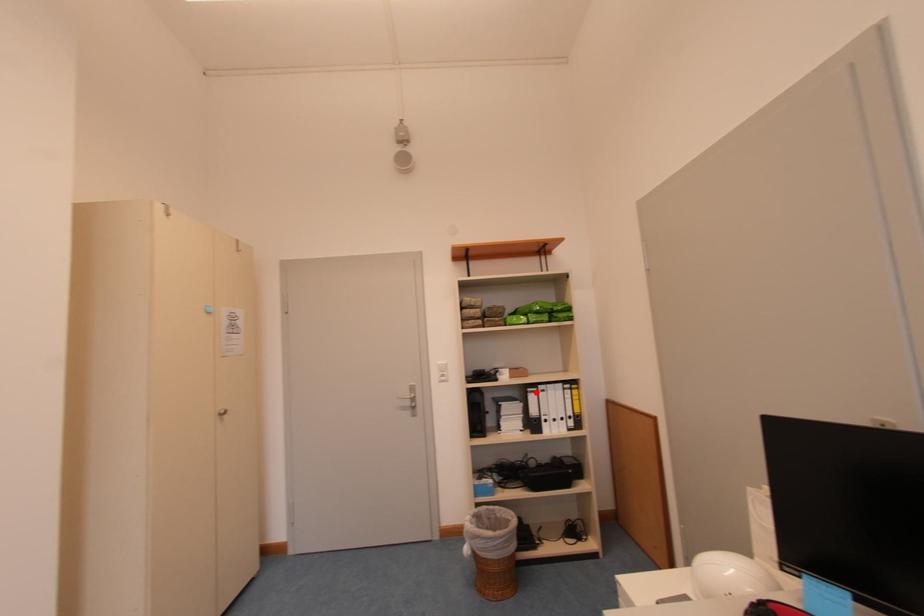
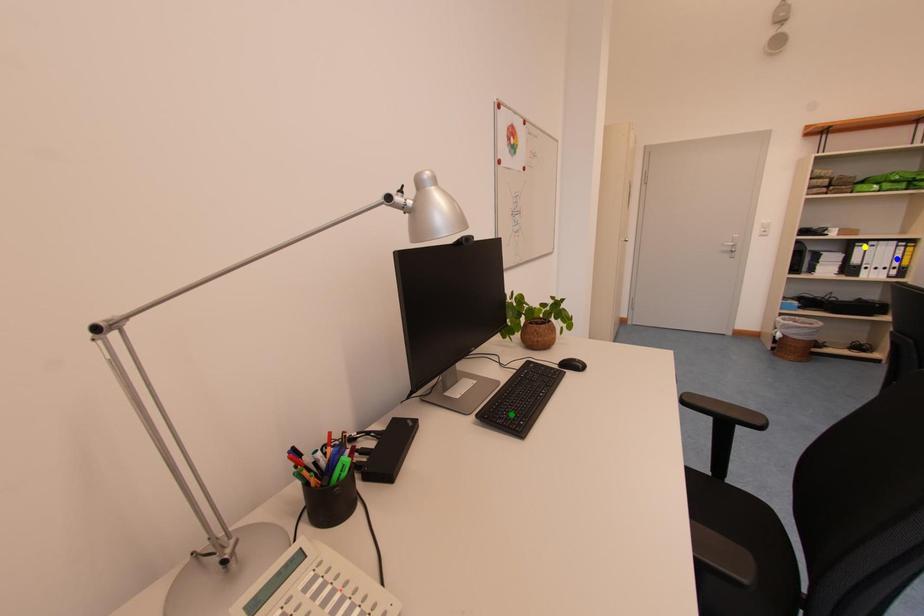
Question: I am providing you with two images of the same scene from different viewpoints. A red point is marked on the first image. You are given multiple points on the second image. Which spot in image 2 lines up with the point in image 1?

Choices:
 (A) blue point
 (B) green point
 (C) yellow point

Answer: (C)